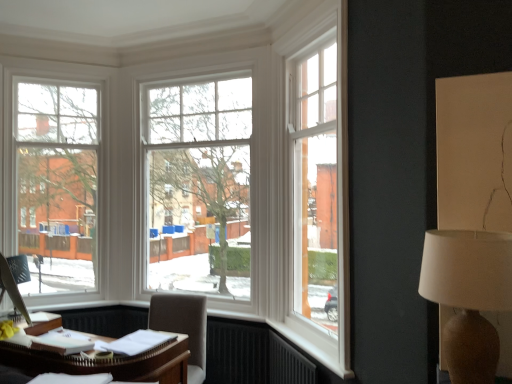
Locate an element on the screen. This screenshot has width=512, height=384. white fabric lampshade at right is located at coordinates (468, 296).

The height and width of the screenshot is (384, 512). Describe the element at coordinates (198, 184) in the screenshot. I see `white wooden window at center, which is the 2th window from left to right` at that location.

Measure the distance between point (159, 322) and camera.

Point (159, 322) is 10.05 feet from camera.

Find the location of a particular element. clear glass window at left, which is the 2th window from right to left is located at coordinates (52, 183).

Which point is more forward, [82,280] or [180,302]?

The point [180,302] is closer.

Can you confirm if clear glass window at left, which appears as the 1th window when viewed from the left, is shorter than light brown fabric chair at lower center?

No, clear glass window at left, which appears as the 1th window when viewed from the left, is not shorter than light brown fabric chair at lower center.

Is clear glass window at left, which is the 2th window from right to left, spatially inside light brown fabric chair at lower center, or outside of it?

clear glass window at left, which is the 2th window from right to left, is spatially situated outside light brown fabric chair at lower center.

How different are the orientations of clear glass window at left, which is the 2th window from right to left, and light brown fabric chair at lower center in degrees?

The angle between the facing direction of clear glass window at left, which is the 2th window from right to left, and the facing direction of light brown fabric chair at lower center is 28.9 degrees.

Based on the photo, considering the sizes of objects clear glass window at left, which is the 2th window from right to left, and white wooden window at center, the first window from the right, in the image provided, who is smaller, clear glass window at left, which is the 2th window from right to left, or white wooden window at center, the first window from the right,?

clear glass window at left, which is the 2th window from right to left, is smaller.

Could you measure the distance between clear glass window at left, which is the 2th window from right to left, and white wooden window at center, which is the 2th window from left to right?

A distance of 92.17 centimeters exists between clear glass window at left, which is the 2th window from right to left, and white wooden window at center, which is the 2th window from left to right.

Between clear glass window at left, which appears as the 1th window when viewed from the left, and white wooden window at center, which is the 2th window from left to right, which one has larger width?

clear glass window at left, which appears as the 1th window when viewed from the left.

Considering the points (32, 179) and (167, 210), which point is behind, point (32, 179) or point (167, 210)?

The point (167, 210) is farther.

Which is more to the left, white fabric lampshade at right or light brown fabric chair at lower center?

From the viewer's perspective, light brown fabric chair at lower center appears more on the left side.

Which is in front, point (468, 286) or point (189, 345)?

The point (468, 286) is in front.

Find the location of a particular element. This screenshot has height=384, width=512. chair that is below the white fabric lampshade at right (from the image's perspective) is located at coordinates (183, 326).

How different are the orientations of white fabric lampshade at right and light brown fabric chair at lower center in degrees?

The angular difference between white fabric lampshade at right and light brown fabric chair at lower center is 12.2 degrees.

From a real-world perspective, is light brown fabric chair at lower center under white wooden window at center, the first window from the right?

Yes, from a real-world perspective, light brown fabric chair at lower center is beneath white wooden window at center, the first window from the right.

Can you confirm if light brown fabric chair at lower center is thinner than white wooden window at center, which is the 2th window from left to right?

In fact, light brown fabric chair at lower center might be wider than white wooden window at center, which is the 2th window from left to right.

Is light brown fabric chair at lower center looking in the opposite direction of white wooden window at center, the first window from the right?

That's not correct — light brown fabric chair at lower center is not looking away from white wooden window at center, the first window from the right.

Could you measure the distance between white wooden window at center, which is the 2th window from left to right, and white fabric lampshade at right?

A distance of 2.63 meters exists between white wooden window at center, which is the 2th window from left to right, and white fabric lampshade at right.

Does white wooden window at center, the first window from the right, touch white fabric lampshade at right?

No, white wooden window at center, the first window from the right, is not touching white fabric lampshade at right.

Is point (242, 114) more distant than point (467, 233)?

That is True.

From a real-world perspective, is white wooden window at center, which is the 2th window from left to right, over white fabric lampshade at right?

Yes, from a real-world perspective, white wooden window at center, which is the 2th window from left to right, is over white fabric lampshade at right

Which object is wider, white fabric lampshade at right or white wooden window at center, which is the 2th window from left to right?

Wider between the two is white fabric lampshade at right.

Based on the photo, is there a large distance between white fabric lampshade at right and white wooden window at center, which is the 2th window from left to right?

That's right, there is a large distance between white fabric lampshade at right and white wooden window at center, which is the 2th window from left to right.

Locate an element on the screen. The image size is (512, 384). lamp that is in front of the white wooden window at center, which is the 2th window from left to right is located at coordinates [x=468, y=296].

Is white fabric lampshade at right facing away from white wooden window at center, the first window from the right?

white fabric lampshade at right is not turned away from white wooden window at center, the first window from the right.

Which of these two, light brown fabric chair at lower center or clear glass window at left, which appears as the 1th window when viewed from the left, stands shorter?

Standing shorter between the two is light brown fabric chair at lower center.

Looking at this image, from the image's perspective, which one is positioned lower, light brown fabric chair at lower center or clear glass window at left, which appears as the 1th window when viewed from the left?

light brown fabric chair at lower center appears lower in the image.

Is point (194, 301) less distant than point (79, 253)?

That is True.

Is light brown fabric chair at lower center to the left of clear glass window at left, which appears as the 1th window when viewed from the left, from the viewer's perspective?

No, light brown fabric chair at lower center is not to the left of clear glass window at left, which appears as the 1th window when viewed from the left.

Identify the location of chair beneath the clear glass window at left, which is the 2th window from right to left (from a real-world perspective). (183, 326).

Find the location of `window that appears above the white wooden window at center, which is the 2th window from left to right (from the image's perspective)`. window that appears above the white wooden window at center, which is the 2th window from left to right (from the image's perspective) is located at coordinates (52, 183).

Estimate the real-world distances between objects in this image. Which object is closer to white fabric lampshade at right, clear glass window at left, which is the 2th window from right to left, or white wooden window at center, the first window from the right?

Among the two, white wooden window at center, the first window from the right, is located nearer to white fabric lampshade at right.

Estimate the real-world distances between objects in this image. Which object is closer to light brown fabric chair at lower center, white fabric lampshade at right or white wooden window at center, which is the 2th window from left to right?

white wooden window at center, which is the 2th window from left to right.

Based on the photo, estimate the real-world distances between objects in this image. Which object is further from white wooden window at center, which is the 2th window from left to right, white fabric lampshade at right or light brown fabric chair at lower center?

white fabric lampshade at right.

Based on their spatial positions, is white wooden window at center, the first window from the right, or clear glass window at left, which is the 2th window from right to left, closer to white fabric lampshade at right?

white wooden window at center, the first window from the right, is positioned closer to the anchor white fabric lampshade at right.

Estimate the real-world distances between objects in this image. Which object is further from white wooden window at center, which is the 2th window from left to right, light brown fabric chair at lower center or white fabric lampshade at right?

Among the two, white fabric lampshade at right is located further to white wooden window at center, which is the 2th window from left to right.

Which object lies further to the anchor point light brown fabric chair at lower center, white wooden window at center, the first window from the right, or white fabric lampshade at right?

Based on the image, white fabric lampshade at right appears to be further to light brown fabric chair at lower center.

When comparing their distances from clear glass window at left, which appears as the 1th window when viewed from the left, does white wooden window at center, which is the 2th window from left to right, or white fabric lampshade at right seem further?

white fabric lampshade at right is further to clear glass window at left, which appears as the 1th window when viewed from the left.

Estimate the real-world distances between objects in this image. Which object is closer to white wooden window at center, the first window from the right, clear glass window at left, which appears as the 1th window when viewed from the left, or light brown fabric chair at lower center?

The object closer to white wooden window at center, the first window from the right, is clear glass window at left, which appears as the 1th window when viewed from the left.

Locate an element on the screen. window between clear glass window at left, which appears as the 1th window when viewed from the left, and white fabric lampshade at right is located at coordinates (198, 184).

Find the location of `chair between clear glass window at left, which appears as the 1th window when viewed from the left, and white wooden window at center, which is the 2th window from left to right, from left to right`. chair between clear glass window at left, which appears as the 1th window when viewed from the left, and white wooden window at center, which is the 2th window from left to right, from left to right is located at coordinates (183, 326).

Image resolution: width=512 pixels, height=384 pixels. I want to click on chair located between clear glass window at left, which is the 2th window from right to left, and white fabric lampshade at right in the left-right direction, so click(183, 326).

Where is `chair between white fabric lampshade at right and white wooden window at center, the first window from the right, from front to back`? This screenshot has width=512, height=384. chair between white fabric lampshade at right and white wooden window at center, the first window from the right, from front to back is located at coordinates (183, 326).